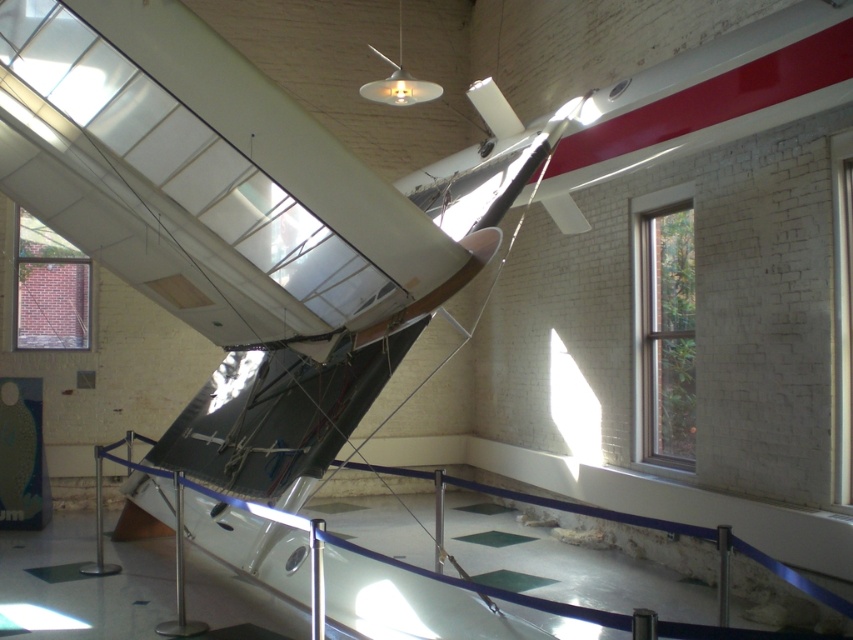
You are an interior designer planning to hang a large poster on the wall in this museum. You have two options for placement based on the scene you see. Which object, the brick wall at upper left or the clear glass window at upper right, would be a better choice for hanging the poster?

The brick wall at upper left is a better choice for hanging the poster since it has a larger size compared to the clear glass window at upper right, providing more space and a solid surface for mounting.

You are a visitor standing in front of the vintage aircraft exhibit. You notice two clear glass windows in the display area. The first is labeled as the clear glass window at right, and the second is the clear glass window at upper right. Which of these two windows is bigger?

The clear glass window at right is larger in size compared to the clear glass window at upper right according to the description.